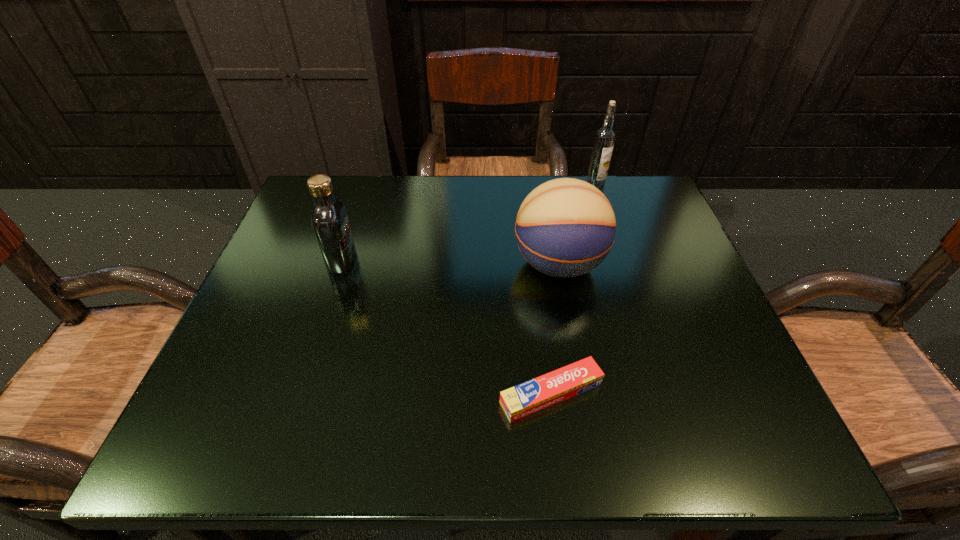
The height and width of the screenshot is (540, 960). I want to click on free space between the nearest object and the right vodka, so click(x=573, y=289).

You are a GUI agent. You are given a task and a screenshot of the screen. Output one action in this format:
    pyautogui.click(x=<x>, y=<y>)
    Task: Click on the vacant region between the farthest object and the nearer vodka
    The height and width of the screenshot is (540, 960).
    Given the screenshot: What is the action you would take?
    pyautogui.click(x=468, y=222)

Find the location of a particular element. Image resolution: width=960 pixels, height=540 pixels. object identified as the closest to the right vodka is located at coordinates (565, 227).

Locate which object is the third closest to the basketball. Please provide its 2D coordinates. Your answer should be formatted as a tuple, i.e. [(x, y)], where the tuple contains the x and y coordinates of a point satisfying the conditions above.

[(330, 222)]

Where is `vacant region that satisfies the following two spatial constraints: 1. on the label of the farthest object; 2. on the patterned surface of the basketball`? The height and width of the screenshot is (540, 960). vacant region that satisfies the following two spatial constraints: 1. on the label of the farthest object; 2. on the patterned surface of the basketball is located at coordinates (622, 265).

This screenshot has height=540, width=960. I want to click on vacant space that satisfies the following two spatial constraints: 1. on the label of the farthest object; 2. on the front-facing side of the leftmost object, so click(620, 260).

I want to click on vacant space that satisfies the following two spatial constraints: 1. on the label of the right vodka; 2. on the patterned surface of the basketball, so pos(622,265).

You are a GUI agent. You are given a task and a screenshot of the screen. Output one action in this format:
    pyautogui.click(x=<x>, y=<y>)
    Task: Click on the vacant space that satisfies the following two spatial constraints: 1. on the label of the farthest object; 2. on the front-facing side of the left vodka
    This screenshot has width=960, height=540.
    Given the screenshot: What is the action you would take?
    pyautogui.click(x=620, y=260)

What are the coordinates of `vacant point that satisfies the following two spatial constraints: 1. on the label of the farthest object; 2. on the front-facing side of the nearer vodka` in the screenshot? It's located at (620, 260).

Locate an element on the screen. This screenshot has width=960, height=540. vacant space that satisfies the following two spatial constraints: 1. on the front-facing side of the left vodka; 2. on the right side of the toothpaste is located at coordinates (299, 393).